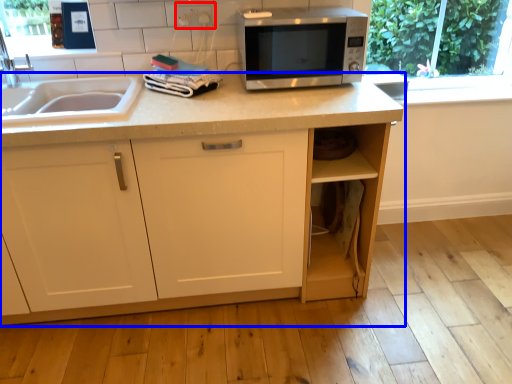
Question: Which object is closer to the camera taking this photo, electric outlet (highlighted by a red box) or cabinetry (highlighted by a blue box)?

Choices:
 (A) electric outlet
 (B) cabinetry

Answer: (B)